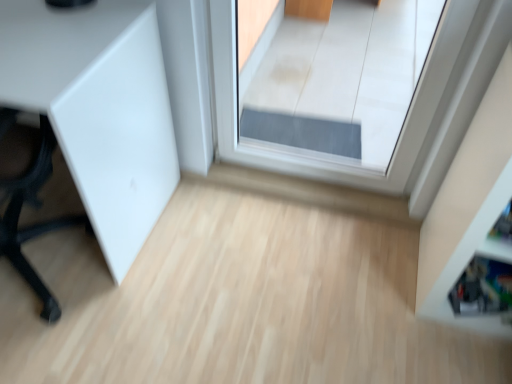
This screenshot has height=384, width=512. What are the coordinates of `vacant area situated to the left side of white glossy shelf at right` in the screenshot? It's located at (372, 284).